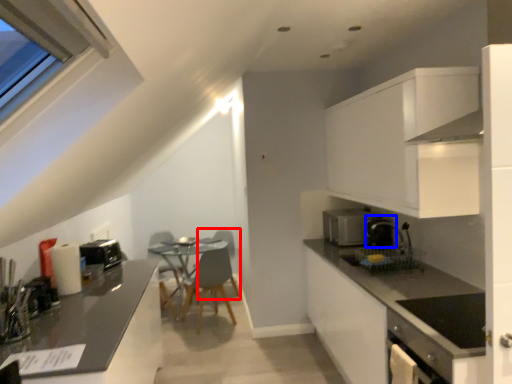
Question: Which object is closer to the camera taking this photo, armchair (highlighted by a red box) or coffee machine (highlighted by a blue box)?

Choices:
 (A) armchair
 (B) coffee machine

Answer: (B)